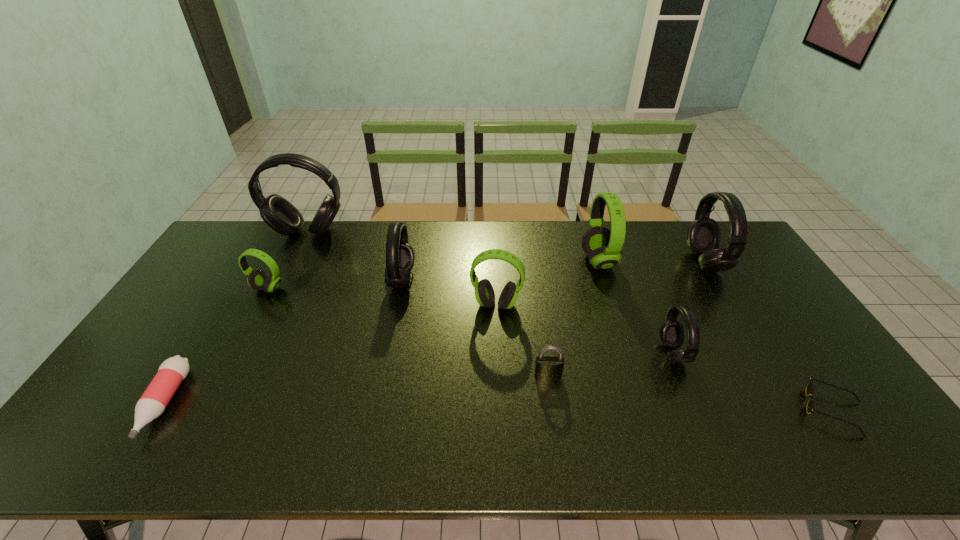
Find the location of a particular element. The width and height of the screenshot is (960, 540). the eighth object from left to right is located at coordinates (672, 333).

Find the location of a particular element. The image size is (960, 540). the nearest gray headset is located at coordinates (672, 333).

Locate an element on the screen. This screenshot has height=540, width=960. the smallest green headset is located at coordinates (258, 280).

Find the location of a particular element. The width and height of the screenshot is (960, 540). padlock is located at coordinates (547, 367).

Where is `black padlock`? Image resolution: width=960 pixels, height=540 pixels. black padlock is located at coordinates (547, 367).

Where is `pink bottle`? The width and height of the screenshot is (960, 540). pink bottle is located at coordinates (153, 402).

Where is `the ninth tallest object`? Image resolution: width=960 pixels, height=540 pixels. the ninth tallest object is located at coordinates (153, 402).

Find the location of `the shortest object`. the shortest object is located at coordinates point(810,387).

Identify the location of black sunglasses. (810, 387).

Locate an element on the screen. The height and width of the screenshot is (540, 960). vacant area situated 0.060m on the earcups of the tallest object is located at coordinates (298, 252).